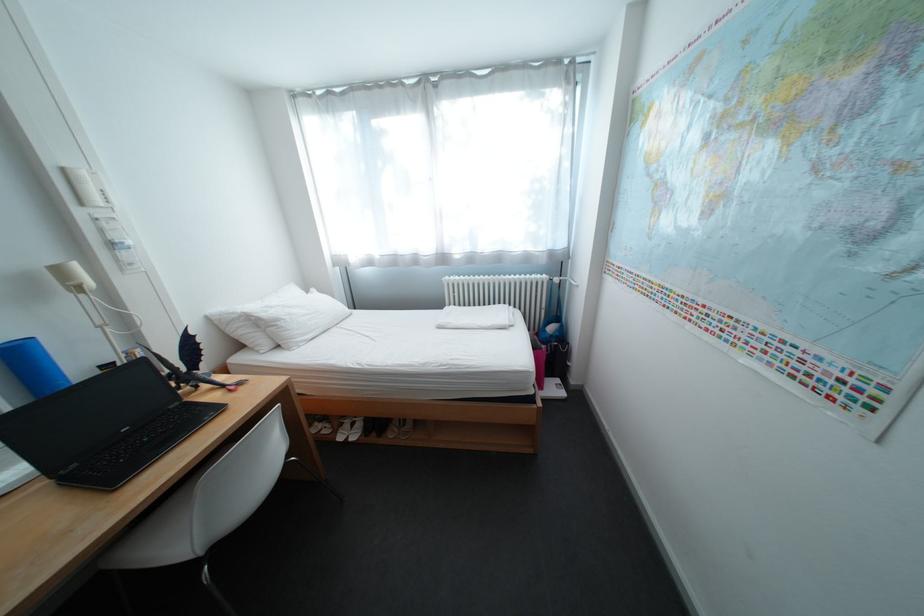
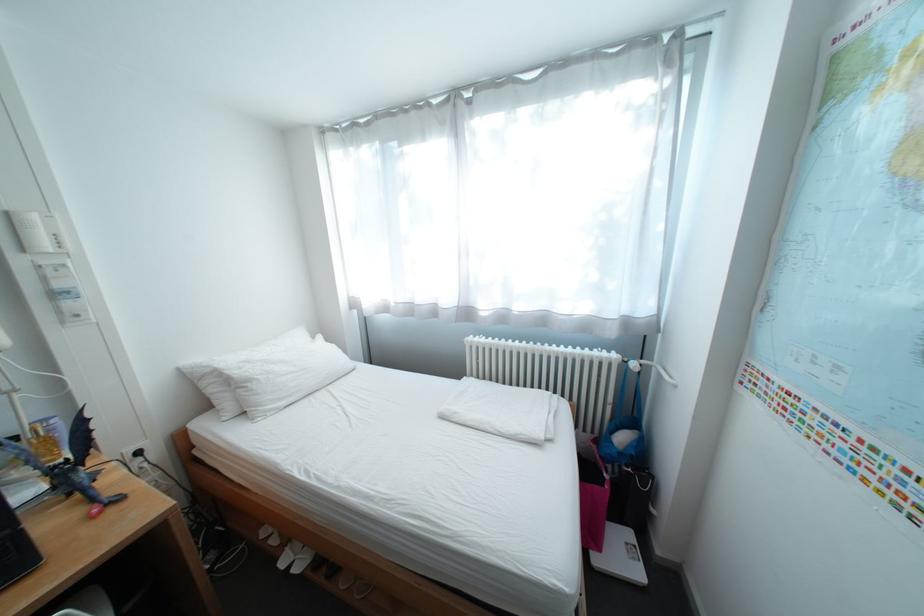
The point at [292,322] is marked in the first image. Where is the corresponding point in the second image?

(263, 383)